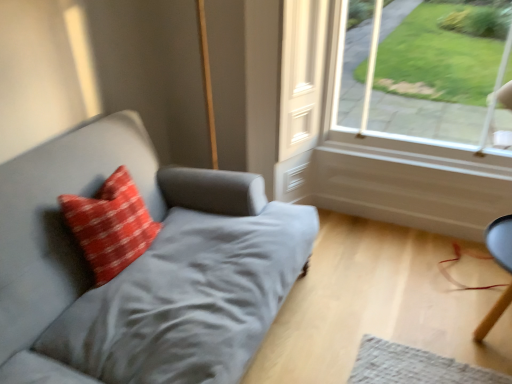
This screenshot has height=384, width=512. What are the coordinates of `free spot behind smooth black chair at lower right` in the screenshot? It's located at (438, 272).